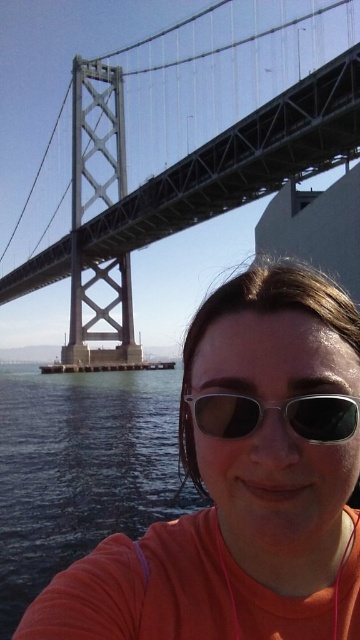
Looking at this image, you are a photographer trying to capture a photo of the matte orange shirt at center and the metallic gray suspension bridge at upper center. Which object would appear larger in the photo?

The matte orange shirt at center would appear larger in the photo because it is closer to the viewer than the metallic gray suspension bridge at upper center.

You are a photographer planning to capture the Oakland Bay Bridge in your shot. You want to position your camera so that the metallic gray suspension bridge at upper center is centered in the frame. According to the coordinates provided, what are the exact coordinates where you should aim your camera?

The metallic gray suspension bridge at upper center is located at coordinates point [191,147], so you should aim your camera at those coordinates to center it in the frame.

You are a photographer trying to capture a photo of the metallic gray suspension bridge at upper center and the sunglasses at center. Which object is positioned higher in the frame?

The metallic gray suspension bridge at upper center is located above the sunglasses at center, so it is positioned higher in the frame.